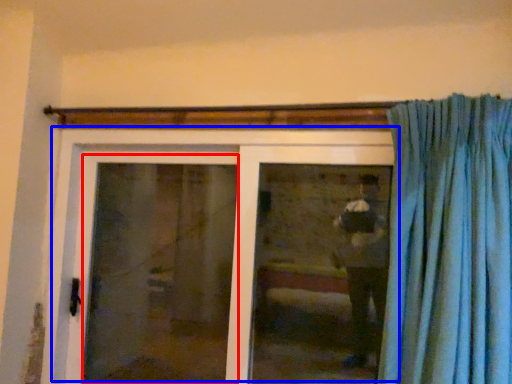
Question: Which point is further to the camera, screen door (highlighted by a red box) or door (highlighted by a blue box)?

Choices:
 (A) screen door
 (B) door

Answer: (A)